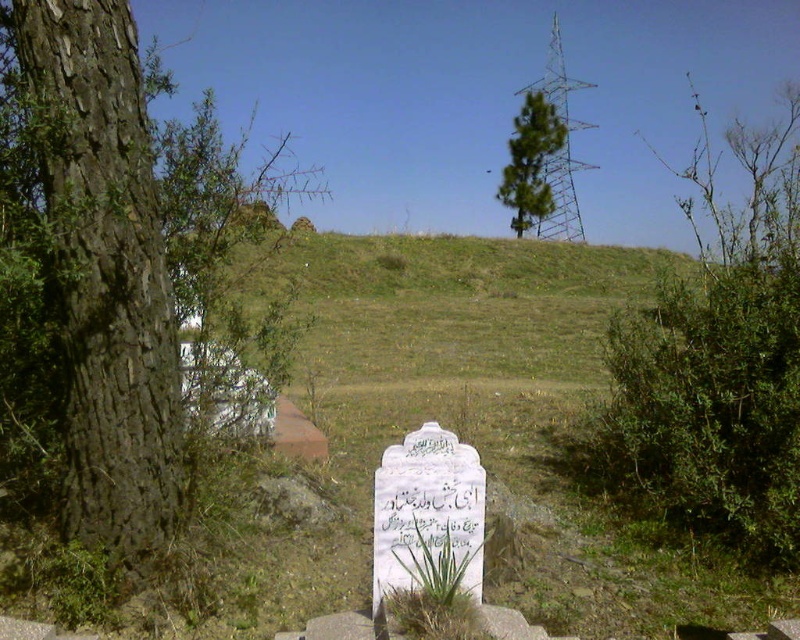
Question: Which object is closer to the camera taking this photo?

Choices:
 (A) green leafy bush at upper right
 (B) brown rough bark tree at left
 (C) green leafy tree at upper center
 (D) white stone writing at center

Answer: (D)

Question: Is green leafy bush at upper right in front of white stone writing at center?

Choices:
 (A) yes
 (B) no

Answer: (B)

Question: Is green leafy bush at upper right closer to the viewer compared to green leafy tree at upper center?

Choices:
 (A) no
 (B) yes

Answer: (B)

Question: Which is farther from the brown rough bark tree at left?

Choices:
 (A) green leafy bush at upper right
 (B) white stone writing at center
 (C) green leafy tree at upper center

Answer: (C)

Question: Can you confirm if white stone writing at center is thinner than green leafy tree at upper center?

Choices:
 (A) yes
 (B) no

Answer: (A)

Question: Which is farther from the green leafy bush at upper right?

Choices:
 (A) brown rough bark tree at left
 (B) white stone writing at center

Answer: (A)